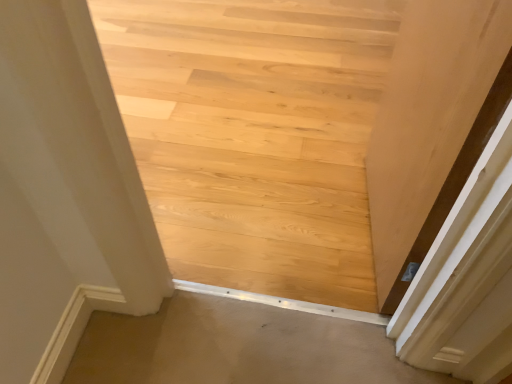
Question: Considering the positions of point (380, 94) and point (365, 375), is point (380, 94) closer or farther from the camera than point (365, 375)?

Choices:
 (A) farther
 (B) closer

Answer: (A)

Question: Is natural wood floor at center taller or shorter than beige carpet at lower center?

Choices:
 (A) short
 (B) tall

Answer: (B)

Question: Estimate the real-world distances between objects in this image. Which object is closer to the beige carpet at lower center?

Choices:
 (A) natural wood floor at center
 (B) matte wood door at right

Answer: (B)

Question: Which object is the farthest from the natural wood floor at center?

Choices:
 (A) beige carpet at lower center
 (B) matte wood door at right

Answer: (A)